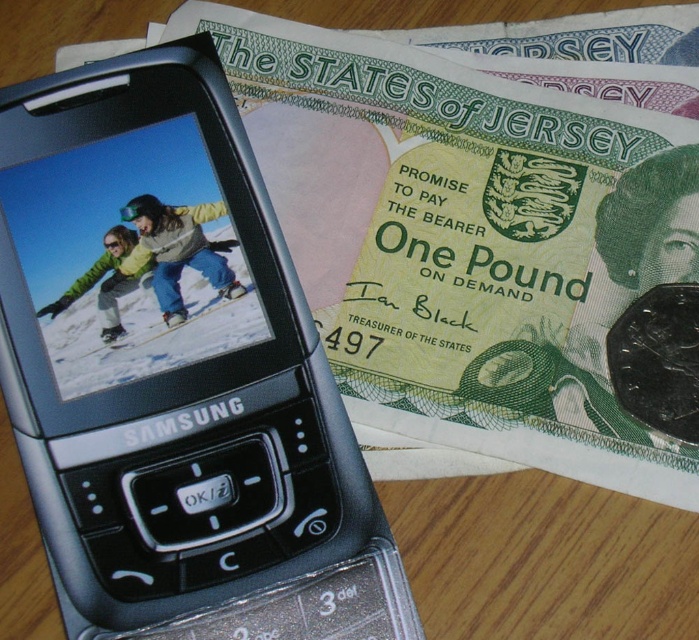
Can you confirm if black plastic samsung phone at upper left is positioned to the left of matte yellow snowboarder at center?

Incorrect, black plastic samsung phone at upper left is not on the left side of matte yellow snowboarder at center.

Is black plastic samsung phone at upper left above matte yellow snowboarder at center?

Actually, black plastic samsung phone at upper left is below matte yellow snowboarder at center.

Between point (165, 442) and point (196, 228), which one is positioned in front?

Point (165, 442) is in front.

Locate an element on the screen. black plastic samsung phone at upper left is located at coordinates (175, 371).